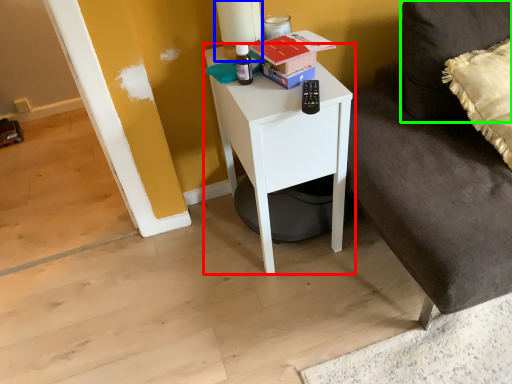
Question: Which is farther away from nightstand (highlighted by a red box)? table lamp (highlighted by a blue box) or pillow (highlighted by a green box)?

Choices:
 (A) table lamp
 (B) pillow

Answer: (B)